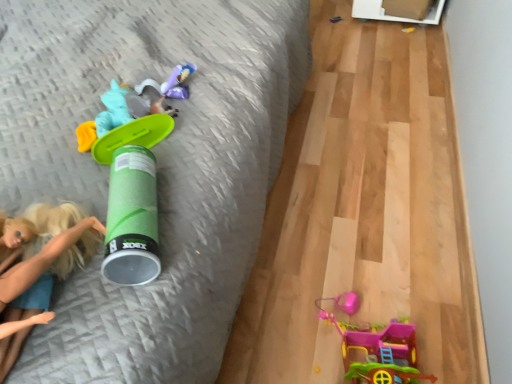
Locate an element on the screen. vacant space that is to the left of metallic silver toy at upper right, acting as the 5th toy starting from the left is located at coordinates (321, 20).